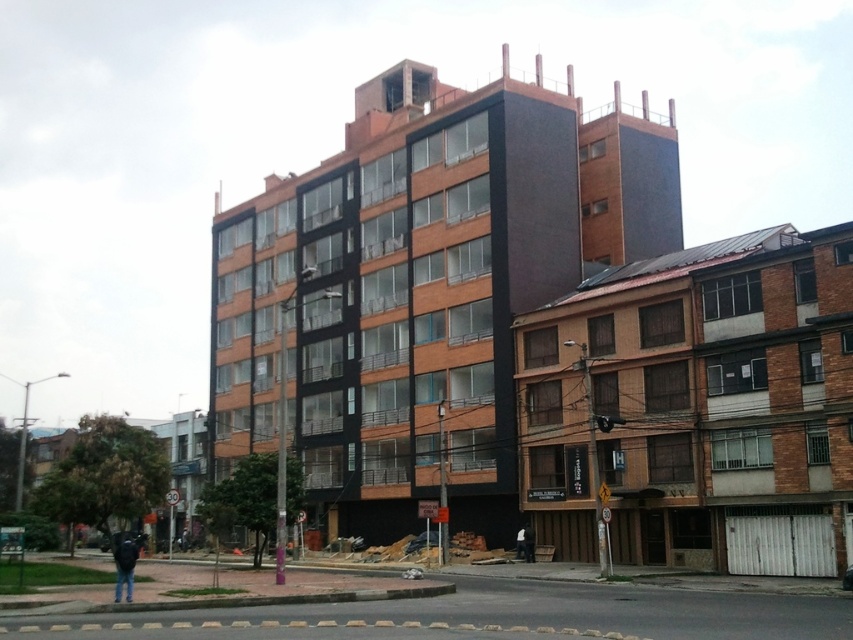
You are a pedestrian standing on the sidewalk and see the orange brick building at center and the dark blue jeans at lower left. Which object is located to the right of the other?

The orange brick building at center is positioned on the right side of dark blue jeans at lower left.

You are a delivery drone that can carry packages up to 10 meters in distance. You need to deliver a package from the modern multi story building on the left to the orange brick building at center. Can you make the delivery directly without landing?

The distance between the modern multi story building on the left and the orange brick building at center is 58.10 meters. Since the drone can only carry packages up to 10 meters, it cannot make the delivery directly without landing.